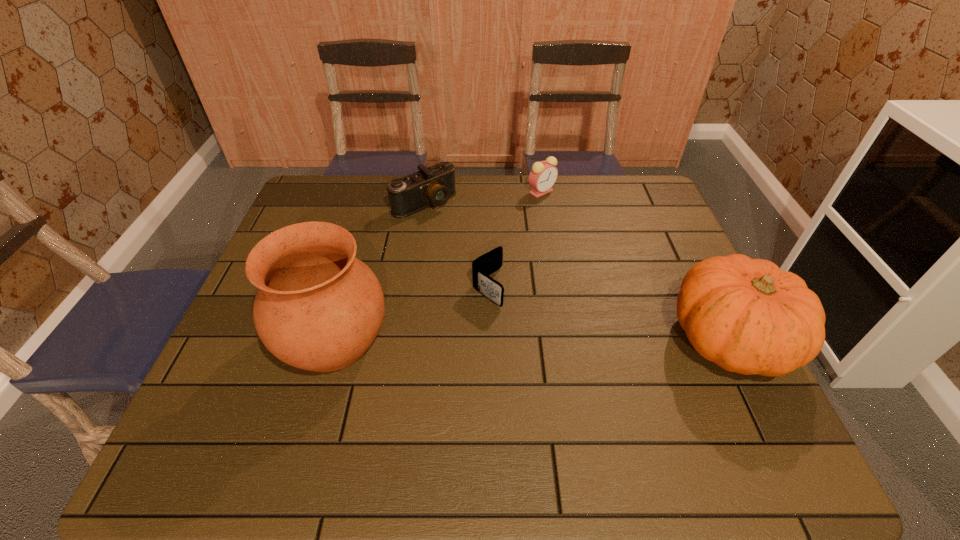
In the image, there is a desktop. At what (x,y) coordinates should I click in order to perform the action: click on vacant space at the near left corner. Please return your answer as a coordinate pair (x, y). This screenshot has width=960, height=540. Looking at the image, I should click on (272, 400).

In the image, there is a desktop. Where is `vacant space at the far right corner`? vacant space at the far right corner is located at coordinates (620, 201).

This screenshot has width=960, height=540. In the image, there is a desktop. Find the location of `free space at the near right corner`. free space at the near right corner is located at coordinates (737, 413).

Identify the location of empty space that is in between the tallest object and the second object from right to left. The image size is (960, 540). (438, 266).

You are a GUI agent. You are given a task and a screenshot of the screen. Output one action in this format:
    pyautogui.click(x=<x>, y=<y>)
    Task: Click on the unoccupied area between the fourth shortest object and the camera
    
    Given the screenshot: What is the action you would take?
    pyautogui.click(x=578, y=271)

Image resolution: width=960 pixels, height=540 pixels. Identify the location of empty space between the second object from right to left and the camera. click(x=483, y=197).

Locate an element on the screen. Image resolution: width=960 pixels, height=540 pixels. vacant area that lies between the tallest object and the fourth shortest object is located at coordinates (532, 340).

The height and width of the screenshot is (540, 960). What are the coordinates of `unoccupied area between the fourth shortest object and the alarm clock` in the screenshot? It's located at (636, 265).

The height and width of the screenshot is (540, 960). I want to click on unoccupied position between the alarm clock and the pottery, so click(438, 266).

In order to click on vacant space that is in between the second tallest object and the camera in this screenshot , I will do `click(578, 271)`.